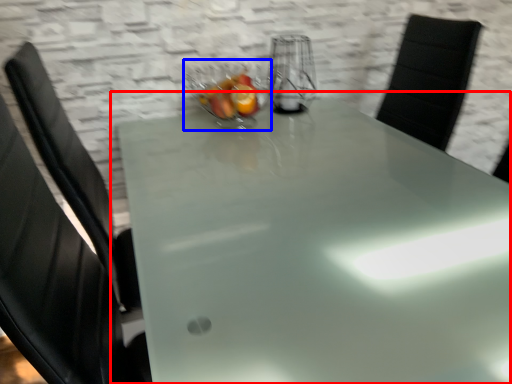
Question: Which of the following is the farthest to the observer, table (highlighted by a red box) or glass bowl (highlighted by a blue box)?

Choices:
 (A) table
 (B) glass bowl

Answer: (B)